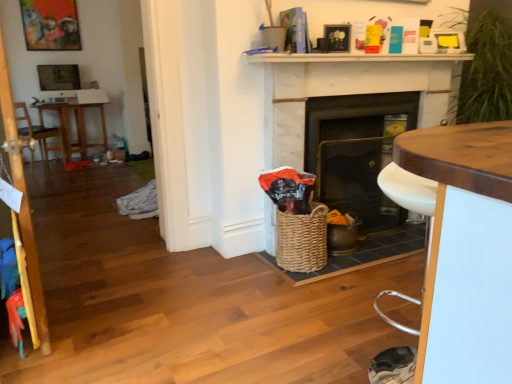
Question: Considering the positions of white glossy desk at center and woven brown basket at center in the image, is white glossy desk at center bigger or smaller than woven brown basket at center?

Choices:
 (A) big
 (B) small

Answer: (A)

Question: From the image's perspective, is white glossy desk at center above or below woven brown basket at center?

Choices:
 (A) below
 (B) above

Answer: (A)

Question: Estimate the real-world distances between objects in this image. Which object is closer to the wooden picture frame at upper left?

Choices:
 (A) woven brown basket at center
 (B) wooden armchair at left
 (C) matte black fireplace at center, the 1th fireplace positioned from the left
 (D) brown wooden table at left
 (E) white marble fireplace at center, arranged as the 1th fireplace when viewed from the right

Answer: (D)

Question: Which object is positioned farthest from the white marble fireplace at upper center?

Choices:
 (A) wooden armchair at left
 (B) woven brown basket at center
 (C) brown wooden table at left
 (D) white glossy desk at center
 (E) wooden picture frame at upper left

Answer: (E)